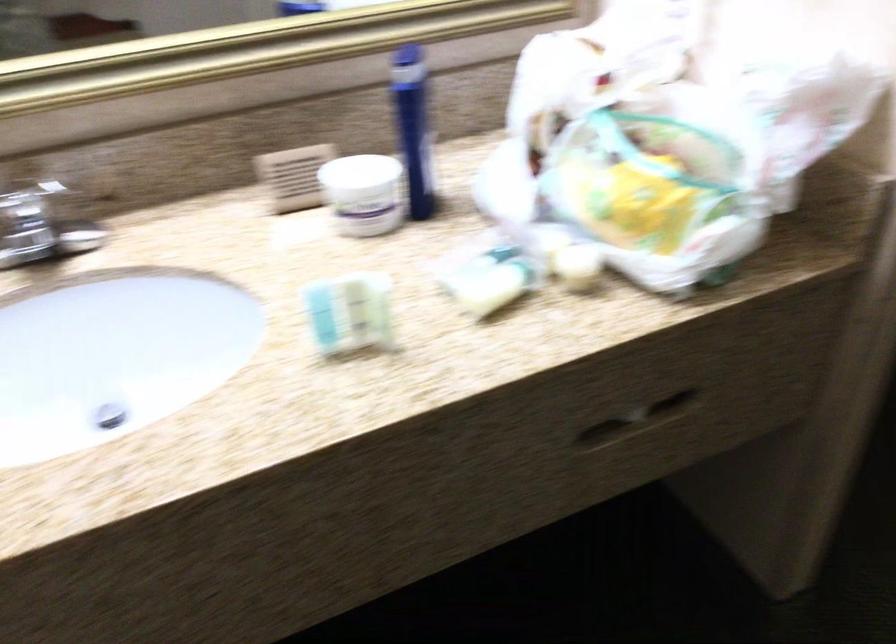
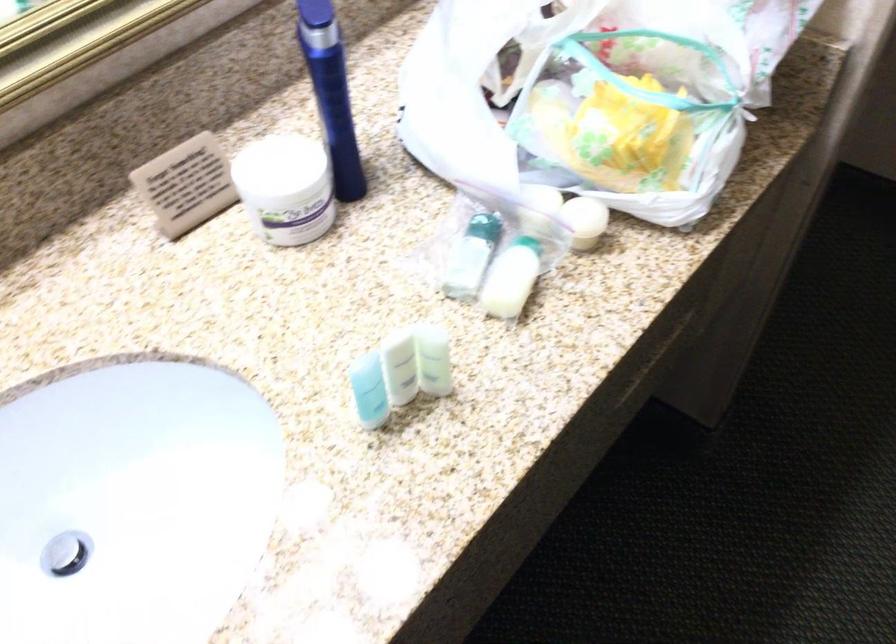
Find the pixel in the second image that matches the point at 500,272 in the first image.

(518, 261)